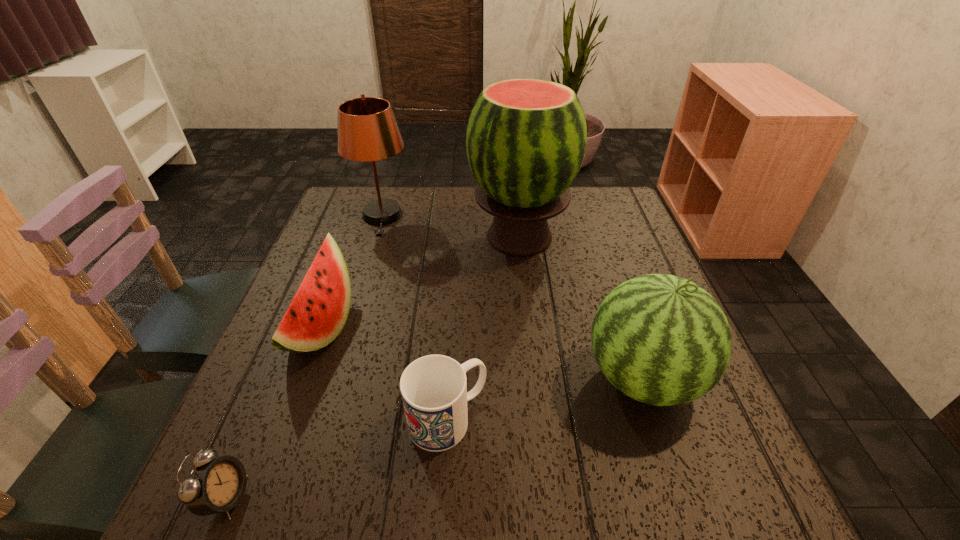
Identify the location of the closest watermelon to the fourth shortest object. (526, 139).

This screenshot has width=960, height=540. I want to click on vacant space that satisfies the following two spatial constraints: 1. on the front-facing side of the lampshade; 2. on the outer rind of the fourth tallest object, so click(348, 328).

The width and height of the screenshot is (960, 540). In order to click on vacant space that satisfies the following two spatial constraints: 1. on the outer rind of the fourth tallest object; 2. on the right side of the mug in this screenshot , I will do tap(288, 419).

Identify the location of free space that satisfies the following two spatial constraints: 1. on the front-facing side of the lampshade; 2. on the face of the alarm clock. The image size is (960, 540). (297, 497).

Identify the location of vacant area that satisfies the following two spatial constraints: 1. on the outer rind of the second shortest watermelon; 2. on the right side of the leftmost watermelon. (303, 378).

Identify the location of blank area in the image that satisfies the following two spatial constraints: 1. on the front-facing side of the lampshade; 2. on the right side of the second shortest object. (321, 419).

Image resolution: width=960 pixels, height=540 pixels. What are the coordinates of `vacant position in the image that satisfies the following two spatial constraints: 1. on the front-facing side of the tallest watermelon; 2. on the right side of the lampshade` in the screenshot? It's located at (375, 237).

The image size is (960, 540). What are the coordinates of `free spot that satisfies the following two spatial constraints: 1. on the outer rind of the fifth tallest object; 2. on the right side of the leftmost watermelon` in the screenshot? It's located at (288, 419).

This screenshot has width=960, height=540. Identify the location of vacant position in the image that satisfies the following two spatial constraints: 1. on the front side of the tallest watermelon; 2. on the outer rind of the fourth tallest object. (530, 328).